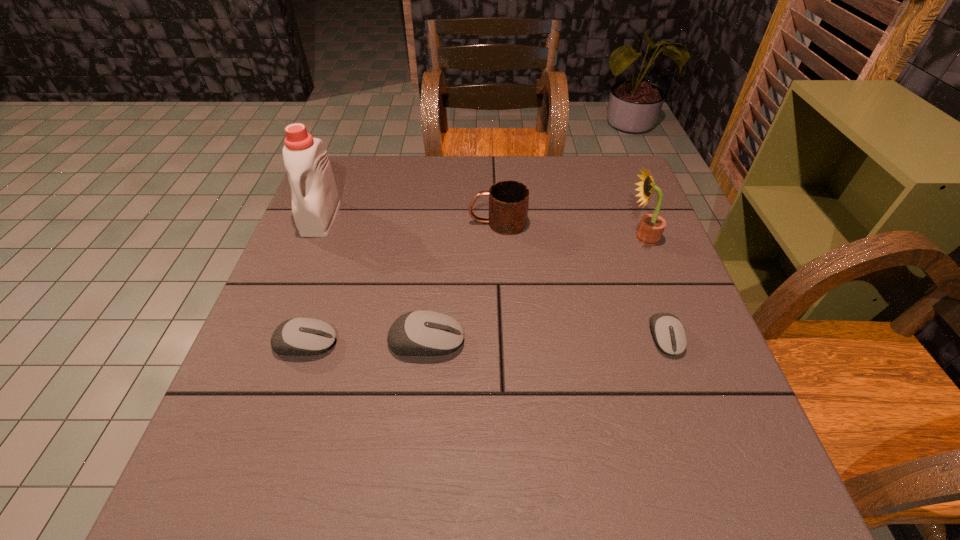
The image size is (960, 540). What are the coordinates of `the second tallest computer equipment` in the screenshot? It's located at (303, 336).

Where is `the fifth tallest object`? The height and width of the screenshot is (540, 960). the fifth tallest object is located at coordinates (303, 336).

Where is `the tallest computer equipment`? The height and width of the screenshot is (540, 960). the tallest computer equipment is located at coordinates (417, 333).

Where is `the third object from left to right`? This screenshot has height=540, width=960. the third object from left to right is located at coordinates (417, 333).

This screenshot has width=960, height=540. I want to click on the shortest computer equipment, so click(x=669, y=334).

Identify the location of the shortest object. (669, 334).

You are a GUI agent. You are given a task and a screenshot of the screen. Output one action in this format:
    pyautogui.click(x=<x>, y=<y>)
    Task: Click on the third object from right to left
    The height and width of the screenshot is (540, 960).
    Given the screenshot: What is the action you would take?
    508,200

Where is `the fourth shortest object`? the fourth shortest object is located at coordinates (508, 200).

This screenshot has width=960, height=540. What are the coordinates of `detergent` in the screenshot? It's located at (315, 199).

Locate an element on the screen. sunflower is located at coordinates (651, 227).